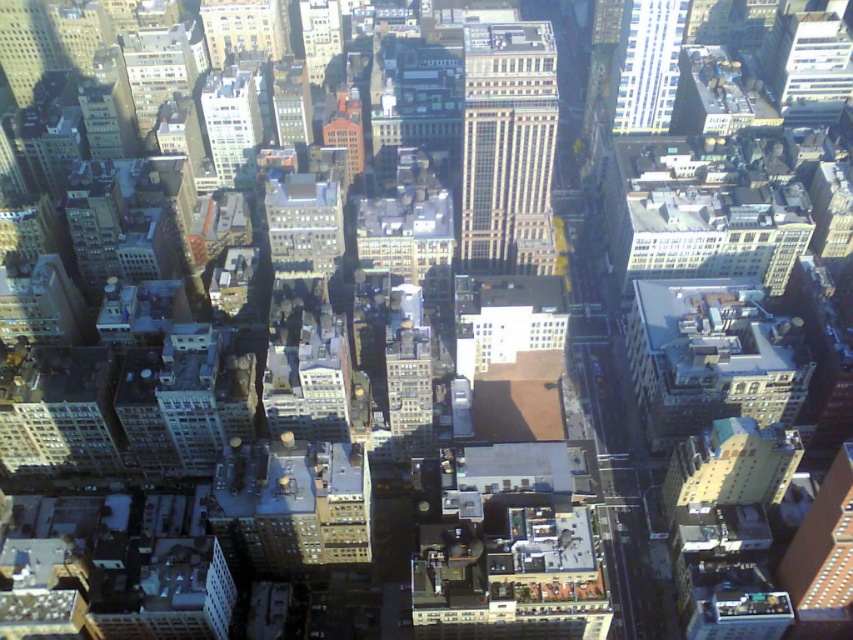
Question: Observing the image, what is the correct spatial positioning of beige brick building at center in reference to brick building at center?

Choices:
 (A) left
 (B) right

Answer: (B)

Question: Based on their relative distances, which object is nearer to the brick building at center?

Choices:
 (A) glassy reflective skyscraper at upper right
 (B) matte glass skyscraper at upper left
 (C) beige brick building at center

Answer: (C)

Question: Is brick building at center smaller than matte glass skyscraper at upper left?

Choices:
 (A) no
 (B) yes

Answer: (B)

Question: Does glassy reflective skyscraper at upper right have a smaller size compared to matte glass skyscraper at upper left?

Choices:
 (A) no
 (B) yes

Answer: (A)

Question: Which object appears farthest from the camera in this image?

Choices:
 (A) brick building at center
 (B) matte glass skyscraper at upper left
 (C) glassy reflective skyscraper at upper right
 (D) beige brick building at center

Answer: (B)

Question: Which object is positioned farthest from the beige brick building at center?

Choices:
 (A) brick building at center
 (B) matte glass skyscraper at upper left

Answer: (B)